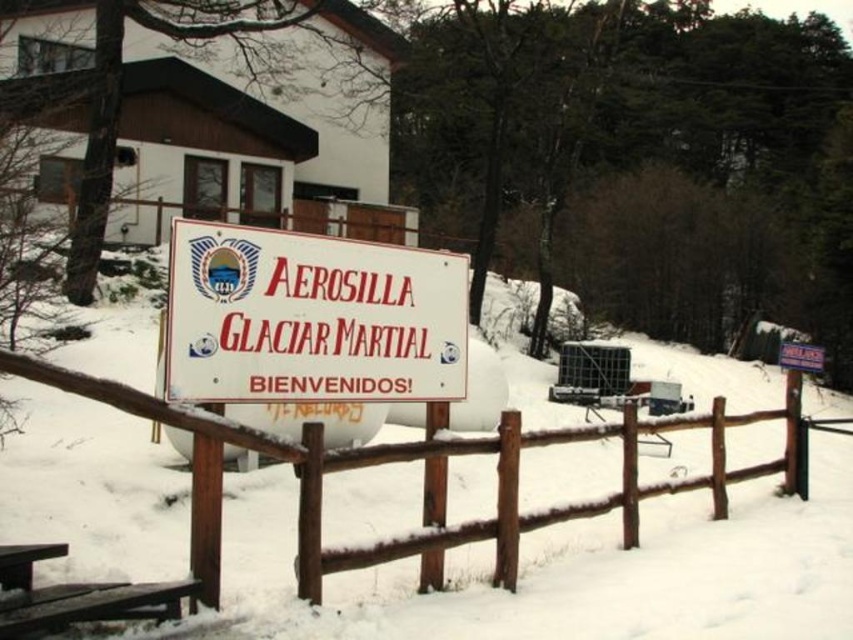
Does white matte sign at center have a greater height compared to wooden at center?

Yes, white matte sign at center is taller than wooden at center.

Is white matte sign at center smaller than wooden at center?

No.

Is point (222, 243) closer to viewer compared to point (115, 401)?

No, (222, 243) is further to viewer.

This screenshot has width=853, height=640. Identify the location of white matte sign at center. (310, 317).

Is the position of white matte sign at center more distant than that of brown wooden picnic table at lower left?

That is True.

Image resolution: width=853 pixels, height=640 pixels. What do you see at coordinates (310, 317) in the screenshot?
I see `white matte sign at center` at bounding box center [310, 317].

Who is more distant from viewer, [323,362] or [178,593]?

Point [323,362]

You are a GUI agent. You are given a task and a screenshot of the screen. Output one action in this format:
    pyautogui.click(x=<x>, y=<y>)
    Task: Click on the white matte sign at center
    
    Given the screenshot: What is the action you would take?
    pyautogui.click(x=310, y=317)

Looking at this image, is wooden at center thinner than brown wooden picnic table at lower left?

Yes.

Consider the image. Between wooden at center and brown wooden picnic table at lower left, which one is positioned lower?

brown wooden picnic table at lower left is below.

Who is more forward, (592, 515) or (109, 589)?

Positioned in front is point (109, 589).

Find the location of `wooden at center`. wooden at center is located at coordinates (424, 476).